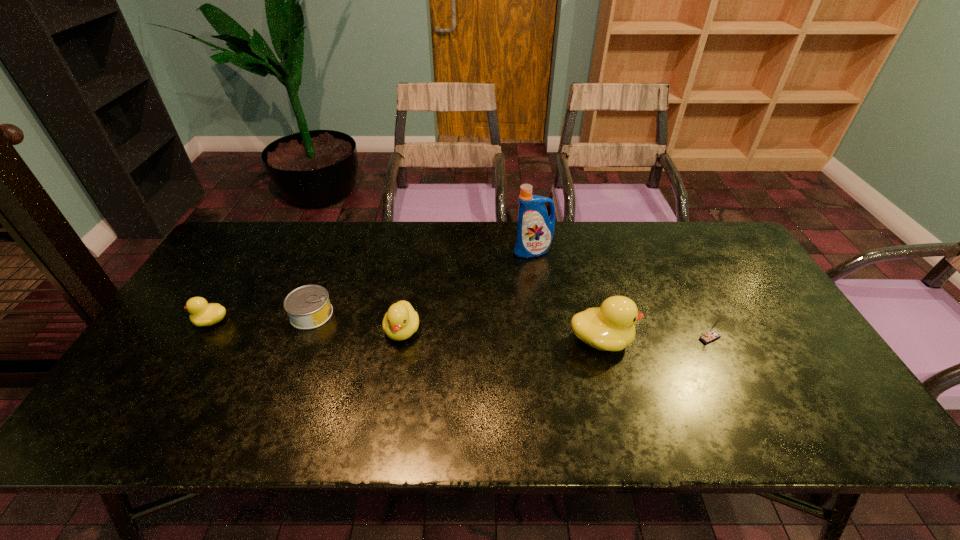
Where is `vacant space that satisfies the following two spatial constraints: 1. on the beak of the second shortest duckling; 2. on the right side of the rightmost object`? vacant space that satisfies the following two spatial constraints: 1. on the beak of the second shortest duckling; 2. on the right side of the rightmost object is located at coordinates (401, 338).

Where is `vacant space that satisfies the following two spatial constraints: 1. on the label of the rightmost object; 2. on the right side of the detergent`? This screenshot has height=540, width=960. vacant space that satisfies the following two spatial constraints: 1. on the label of the rightmost object; 2. on the right side of the detergent is located at coordinates pyautogui.click(x=545, y=338).

Where is `free spot that satisfies the following two spatial constraints: 1. on the back side of the matchbox; 2. on the beak of the shortest duckling`? free spot that satisfies the following two spatial constraints: 1. on the back side of the matchbox; 2. on the beak of the shortest duckling is located at coordinates (701, 321).